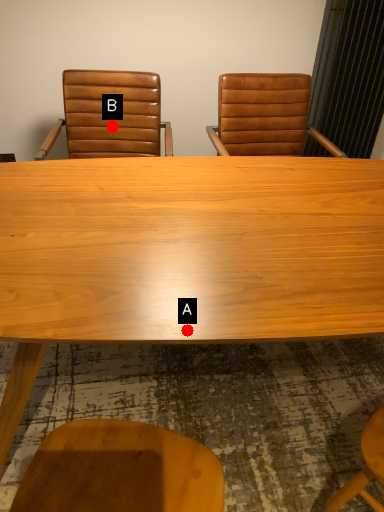
Question: Two points are circled on the image, labeled by A and B beside each circle. Which point is closer to the camera?

Choices:
 (A) A is closer
 (B) B is closer

Answer: (A)